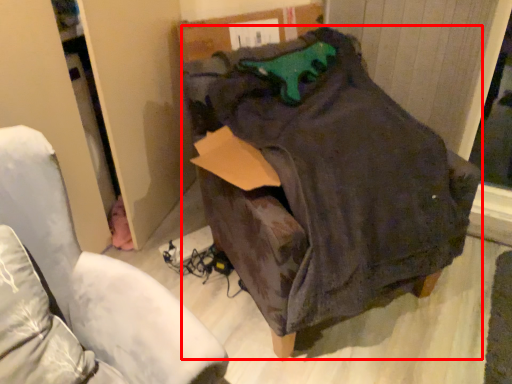
Question: From the image's perspective, considering the relative positions of bean bag chair (annotated by the red box) and furniture in the image provided, where is bean bag chair (annotated by the red box) located with respect to the staircase?

Choices:
 (A) below
 (B) above

Answer: (B)